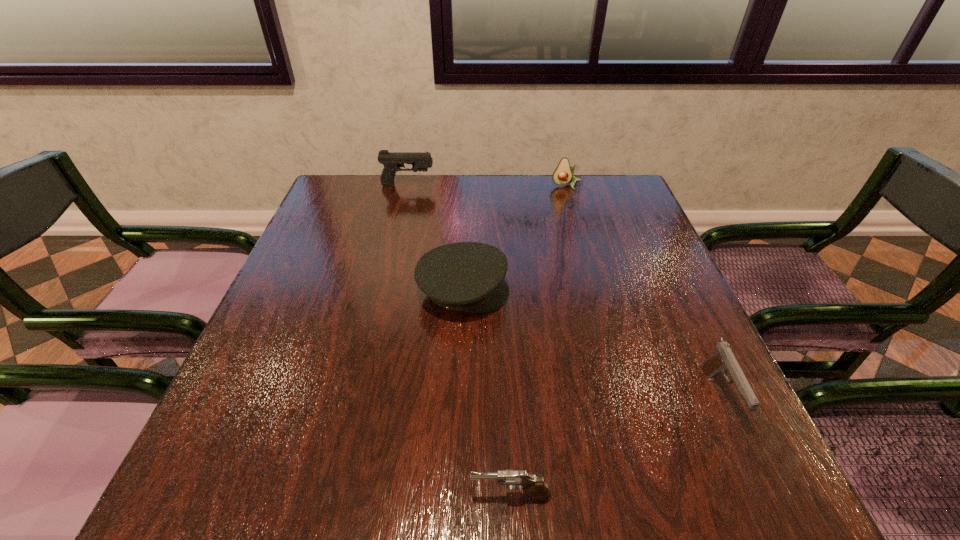
Image resolution: width=960 pixels, height=540 pixels. Identify the location of vacant region that satisfies the following two spatial constraints: 1. on the seed side of the second object from right to left; 2. on the front-facing side of the beret. (596, 292).

Where is `free region that satisfies the following two spatial constraints: 1. at the barrel of the rightmost object; 2. at the barrel of the shortest object`? The image size is (960, 540). free region that satisfies the following two spatial constraints: 1. at the barrel of the rightmost object; 2. at the barrel of the shortest object is located at coordinates (765, 496).